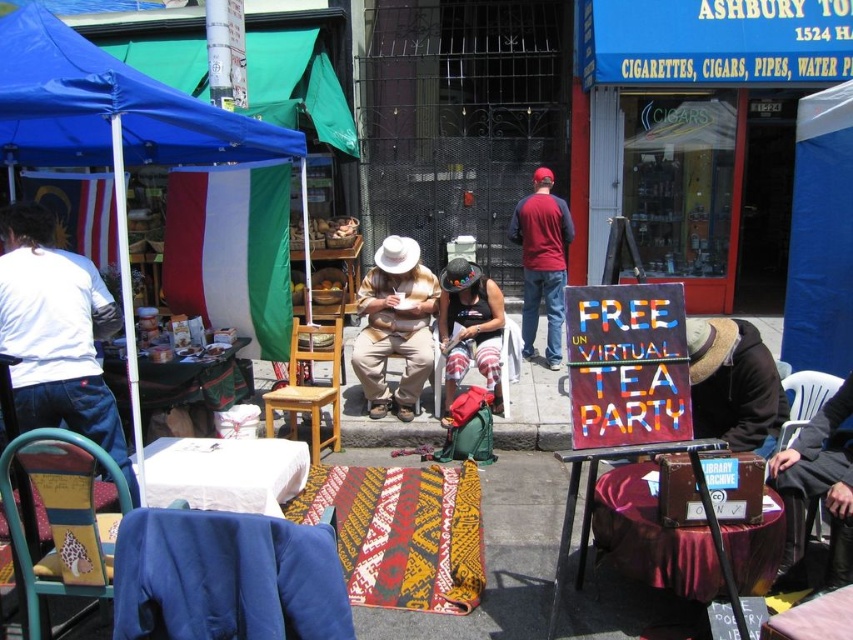
Between point (67, 100) and point (33, 442), which one is positioned behind?

Point (67, 100)

Is blue fabric canopy at upper left smaller than multicolored fabric chair at lower left?

Incorrect, blue fabric canopy at upper left is not smaller in size than multicolored fabric chair at lower left.

Between point (141, 154) and point (32, 577), which one is positioned in front?

Point (32, 577)

At what (x,y) coordinates should I click in order to perform the action: click on blue fabric canopy at upper left. Please return your answer as a coordinate pair (x, y). This screenshot has width=853, height=640. Looking at the image, I should click on (109, 106).

Which is in front, point (334, 417) or point (817, 372)?

Point (817, 372) is in front.

Can you confirm if wooden chair at center is wider than white plastic chair at lower right?

Indeed, wooden chair at center has a greater width compared to white plastic chair at lower right.

Measure the distance between point (293, 364) and camera.

A distance of 6.06 meters exists between point (293, 364) and camera.

The width and height of the screenshot is (853, 640). Identify the location of wooden chair at center. (309, 387).

Can you confirm if multicolored fabric chair at lower left is taller than white plastic chair at lower right?

Yes.

Which is in front, point (99, 522) or point (788, 392)?

Point (99, 522) is more forward.

Where is `multicolored fabric chair at lower left`? This screenshot has height=640, width=853. multicolored fabric chair at lower left is located at coordinates (61, 516).

The width and height of the screenshot is (853, 640). What are the coordinates of `multicolored fabric chair at lower left` in the screenshot? It's located at (61, 516).